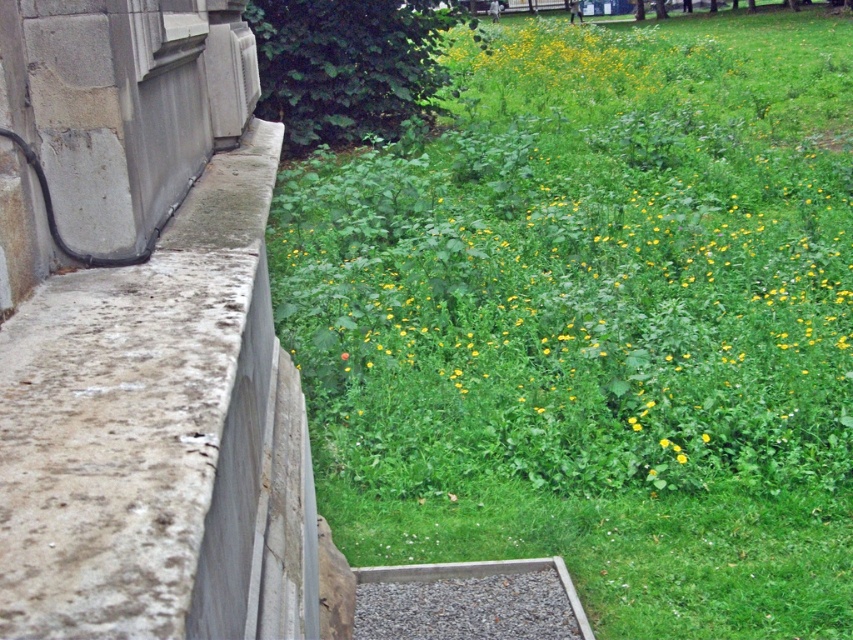
You are standing at the point where the stone wall meets the grassy area. Looking towards the upper right, you see a point marked at coordinates (596, 321). What is located at this point?

The point at coordinates (596, 321) marks green leafy grass at upper right.

In the scene shown: You are a gardener who wants to plant a new flower bed between the green leafy grass at upper right and the gray gravel at bottom. How much space do you have to work with?

The distance between the green leafy grass at upper right and the gray gravel at bottom is 3.53 meters, so you have 3.53 meters of space to work with for the flower bed.

You are a gardener who wants to plant the yellow matte flower at center in the gray gravel at bottom. Considering their sizes, will the flower be visible above the gravel?

The gray gravel at bottom has a larger size compared to yellow matte flower at center, so the flower may be partially or fully obscured by the gravel, making it less visible.